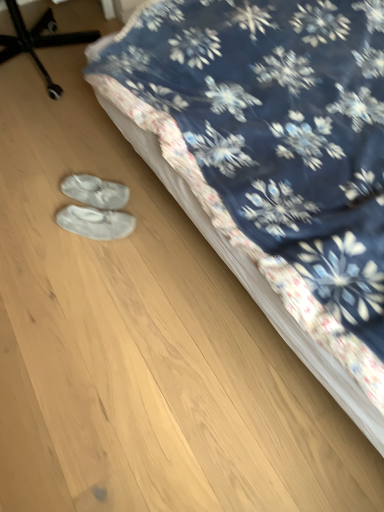
At what (x,y) coordinates should I click in order to perform the action: click on free space to the left of white fabric shoe covers at lower left, arranged as the second footwear when ordered from the bottom. Please return your answer as a coordinate pair (x, y). Looking at the image, I should click on (41, 201).